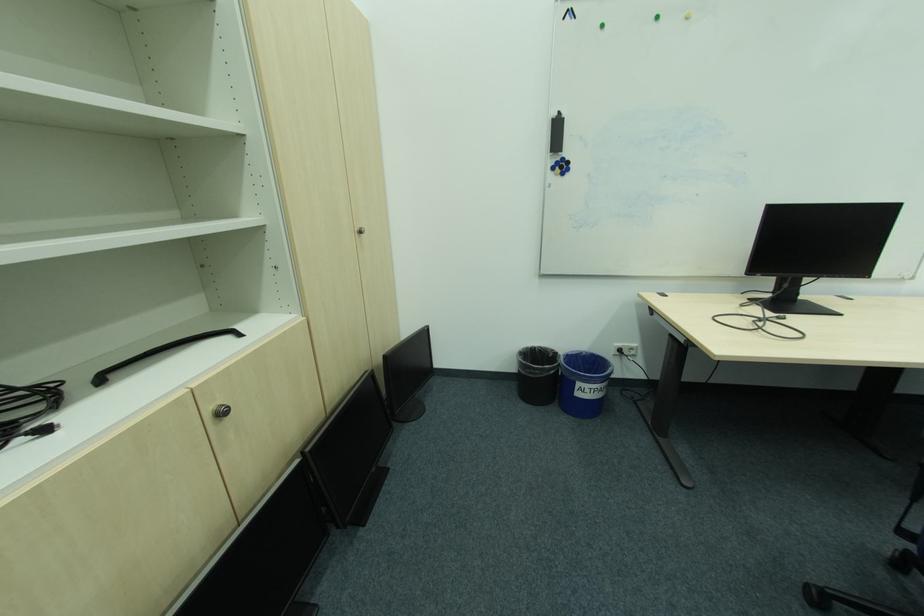
The location [602,25] corresponds to which object?

It refers to a green round magnet.